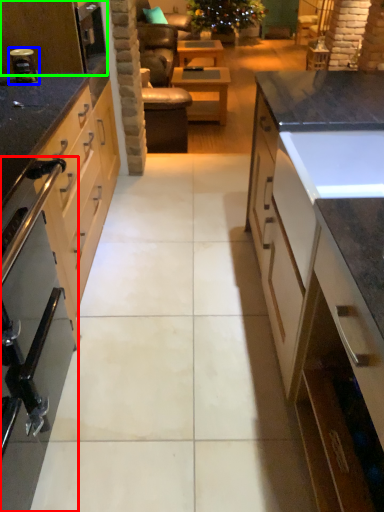
Question: Estimate the real-world distances between objects in this image. Which object is closer to home appliance (highlighted by a red box), appliance (highlighted by a blue box) or kitchen appliance (highlighted by a green box)?

Choices:
 (A) appliance
 (B) kitchen appliance

Answer: (A)